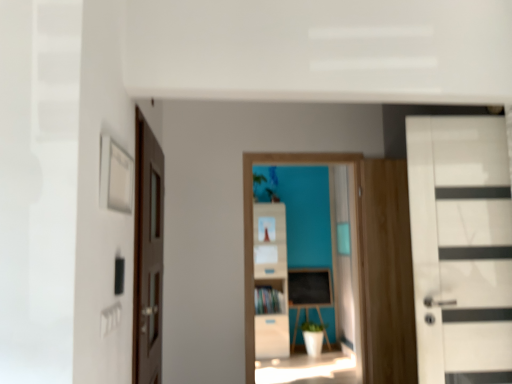
Question: Is wooden cabinet at center wider or thinner than brown wooden door at left, placed as the first door when sorted from left to right?

Choices:
 (A) wide
 (B) thin

Answer: (A)

Question: From a real-world perspective, relative to brown wooden door at left, placed as the first door when sorted from left to right, is wooden cabinet at center vertically above or below?

Choices:
 (A) below
 (B) above

Answer: (A)

Question: Considering the real-world distances, which object is closest to the blackboard at center?

Choices:
 (A) wooden cabinet at center
 (B) white glossy door at right, the second door when ordered from left to right
 (C) wooden file cabinet at center
 (D) brown wooden door at left, placed as the first door when sorted from left to right

Answer: (A)

Question: Which of these objects is positioned closest to the wooden file cabinet at center?

Choices:
 (A) blackboard at center
 (B) white glossy door at right, placed as the 1th door when sorted from right to left
 (C) wooden cabinet at center
 (D) brown wooden door at left, the second door viewed from the right

Answer: (C)